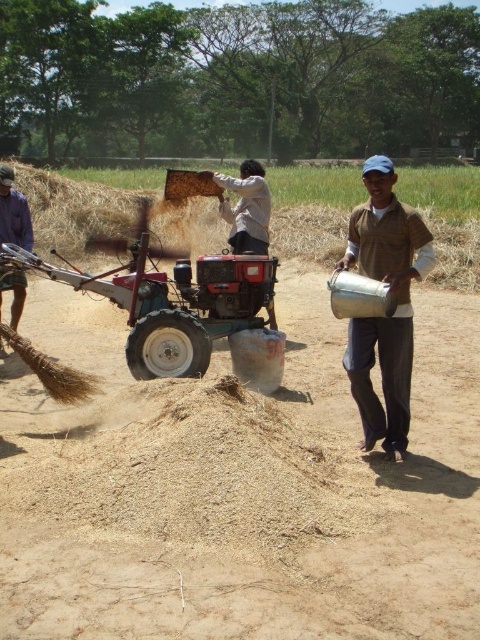
Between silver metallic bucket at right and brushed metal broom at left, which one is positioned lower?

silver metallic bucket at right

Is point (399, 358) more distant than point (0, 337)?

That is False.

Find the location of a particular element. The height and width of the screenshot is (640, 480). silver metallic bucket at right is located at coordinates (396, 308).

The width and height of the screenshot is (480, 640). I want to click on silver metallic bucket at right, so click(x=396, y=308).

Is reddish metallic tractor at center to the right of brushed metal broom at left from the viewer's perspective?

In fact, reddish metallic tractor at center is to the left of brushed metal broom at left.

Describe the element at coordinates (167, 298) in the screenshot. I see `reddish metallic tractor at center` at that location.

Locate an element on the screen. reddish metallic tractor at center is located at coordinates (167, 298).

Which is in front, point (304, 381) or point (420, 230)?

Point (420, 230) is more forward.

Who is higher up, brown dirt track at center or silver metallic bucket at right?

silver metallic bucket at right is higher up.

The image size is (480, 640). In order to click on brown dirt track at center in this screenshot , I will do `click(240, 493)`.